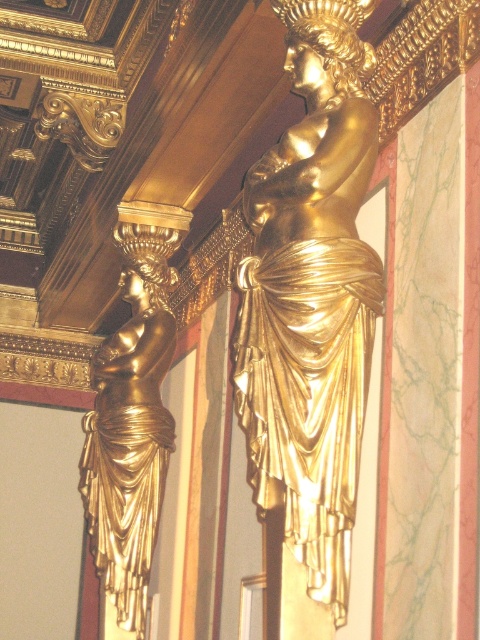
Question: Which of the following is the farthest from the observer?

Choices:
 (A) (105, 497)
 (B) (363, 124)

Answer: (A)

Question: Can you confirm if gold polished statue at center is positioned above gold/gilded draped figure at left?

Choices:
 (A) yes
 (B) no

Answer: (A)

Question: Which point appears farthest from the camera in this image?

Choices:
 (A) click(x=159, y=230)
 (B) click(x=321, y=118)

Answer: (A)

Question: Is gold polished statue at center above gold/gilded draped figure at left?

Choices:
 (A) yes
 (B) no

Answer: (A)

Question: Which point is closer to the camera?

Choices:
 (A) gold polished statue at center
 (B) gold/gilded draped figure at left

Answer: (A)

Question: Is gold polished statue at center to the left of gold/gilded draped figure at left from the viewer's perspective?

Choices:
 (A) no
 (B) yes

Answer: (A)